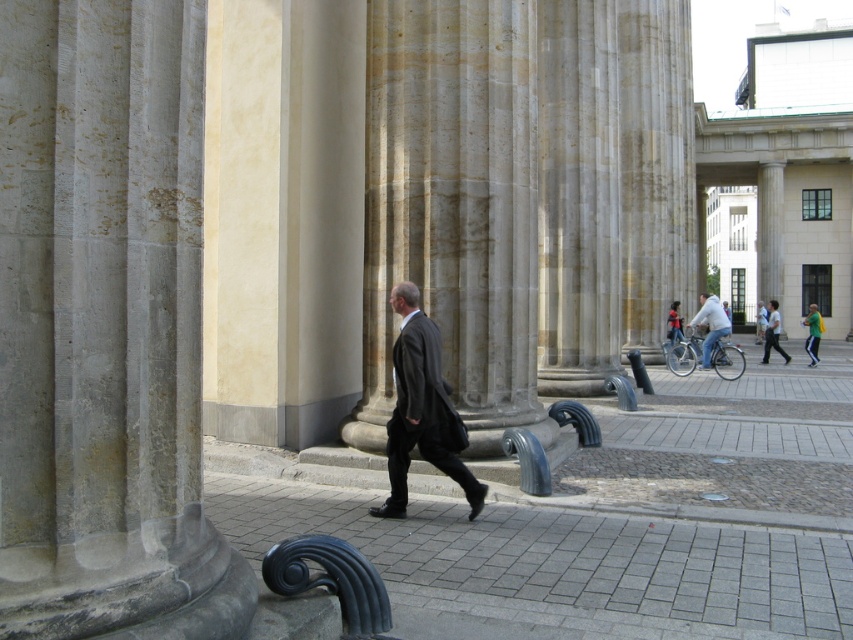
Can you confirm if gray concrete pavement at center is smaller than light gray fabric jacket at center?

Correct, gray concrete pavement at center occupies less space than light gray fabric jacket at center.

Does gray concrete pavement at center have a greater width compared to light gray fabric jacket at center?

No, gray concrete pavement at center is not wider than light gray fabric jacket at center.

Identify the location of gray concrete pavement at center. The image size is (853, 640). (558, 564).

Is gray stone column at center taller than light blue shirt at center?

Yes, gray stone column at center is taller than light blue shirt at center.

Where is `gray stone column at center`? gray stone column at center is located at coordinates (105, 326).

Where is `gray stone column at center`? The height and width of the screenshot is (640, 853). gray stone column at center is located at coordinates (105, 326).

Which of these two, dark gray suit at center or light blue shirt at center, stands taller?

light blue shirt at center is taller.

Is dark gray suit at center above light blue shirt at center?

Incorrect, dark gray suit at center is not positioned above light blue shirt at center.

The image size is (853, 640). Describe the element at coordinates (421, 408) in the screenshot. I see `dark gray suit at center` at that location.

At what (x,y) coordinates should I click in order to perform the action: click on dark gray suit at center. Please return your answer as a coordinate pair (x, y). This screenshot has height=640, width=853. Looking at the image, I should click on (421, 408).